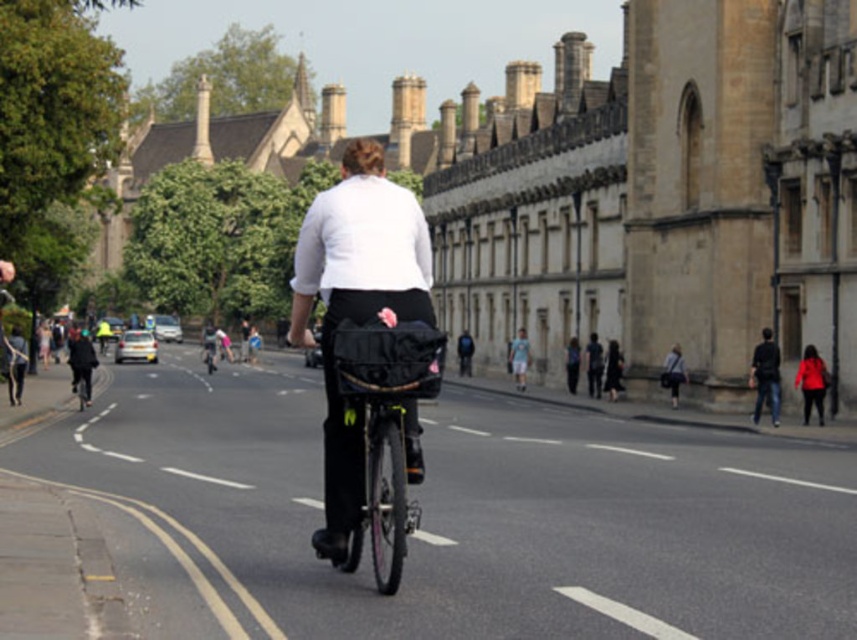
You are a delivery person who needs to carry a large package. The black matte bicycle at center can hold items on its front basket, while the dark blue jeans at right belong to a pedestrian. Which object can better accommodate the package based on their sizes?

The black matte bicycle at center has a larger size compared to the dark blue jeans at right, so the bicycle can better accommodate the large package.

You are a pedestrian standing on the sidewalk and want to cross the street to reach the historic buildings. There is a black matte bicycle at center and dark blue jeans at right in your path. Which object should you avoid first while crossing?

You should avoid the black matte bicycle at center first because it is positioned to the left of the dark blue jeans at right, meaning it is closer to your starting point on the sidewalk.

You are a delivery person who needs to deliver a package to the person wearing the white matte shirt at center. You are currently standing at point 0.0, 0.0. The street is laid out in a grid. Can you walk directly to the point [355,304] where the white matte shirt at center is located, or do you need to follow the road? Explain your reasoning based on the scene description.

Based on the scene description, the street is wide and marked with white lane lines, suggesting it is for vehicles and cyclists. The person on the bicycle is at the center, so the point [355,304] likely corresponds to the road area. Since pedestrians typically walk on sidewalks, not the road, you would need to follow the road and sidewalks to reach the destination safely rather than cutting across the street directly.